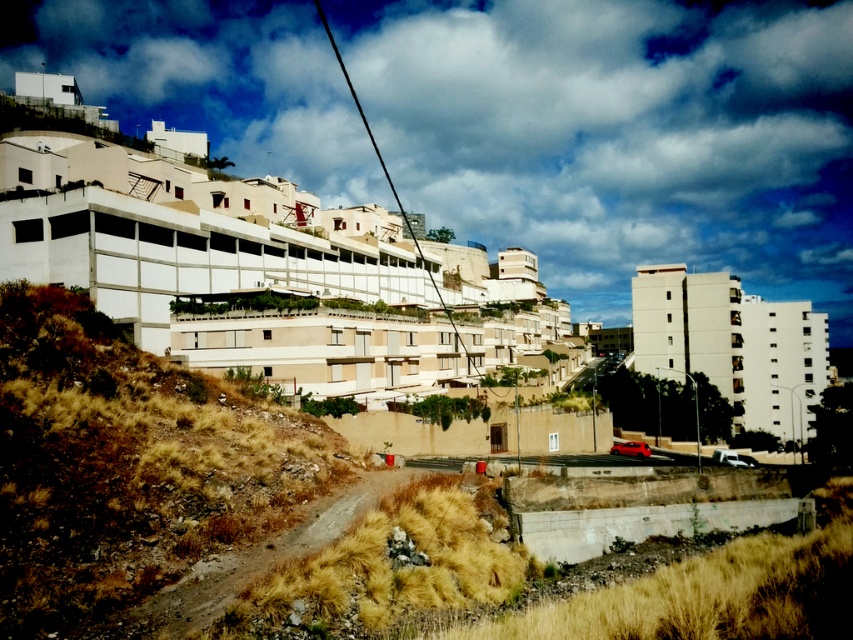
Question: Can you confirm if white smooth building at center-right is positioned to the right of brown gravel path at lower left?

Choices:
 (A) yes
 (B) no

Answer: (A)

Question: Estimate the real-world distances between objects in this image. Which object is farther from the brown grassy hillside at lower left?

Choices:
 (A) white smooth building at center-right
 (B) brown gravel path at lower left

Answer: (A)

Question: Which point is farther to the camera?

Choices:
 (A) white smooth building at center-right
 (B) brown gravel path at lower left
 (C) brown grassy hillside at lower left

Answer: (A)

Question: Does brown grassy hillside at lower left have a greater width compared to white smooth building at center-right?

Choices:
 (A) yes
 (B) no

Answer: (B)

Question: Considering the relative positions of brown grassy hillside at lower left and brown gravel path at lower left in the image provided, where is brown grassy hillside at lower left located with respect to brown gravel path at lower left?

Choices:
 (A) below
 (B) above

Answer: (B)

Question: Which point appears closest to the camera in this image?

Choices:
 (A) pyautogui.click(x=358, y=515)
 (B) pyautogui.click(x=70, y=392)

Answer: (B)